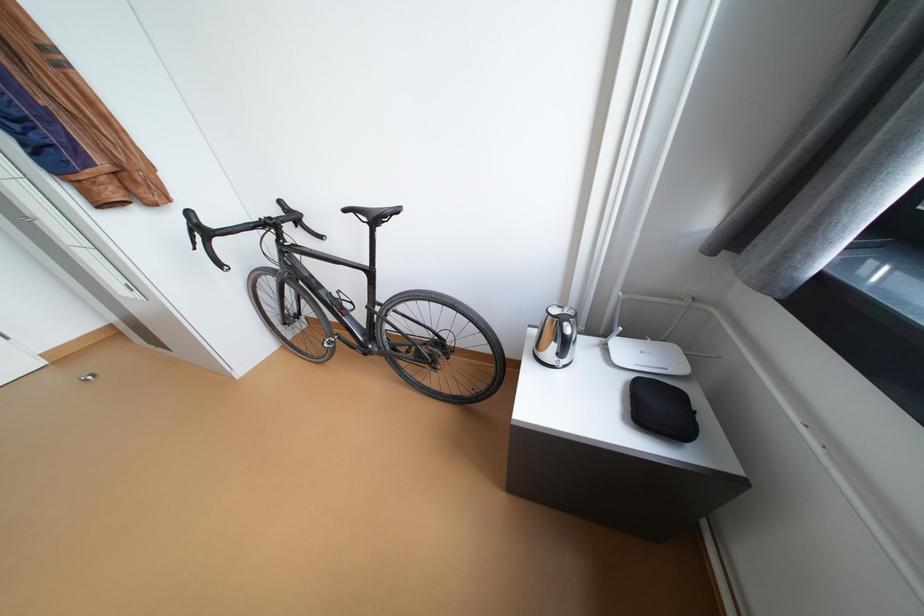
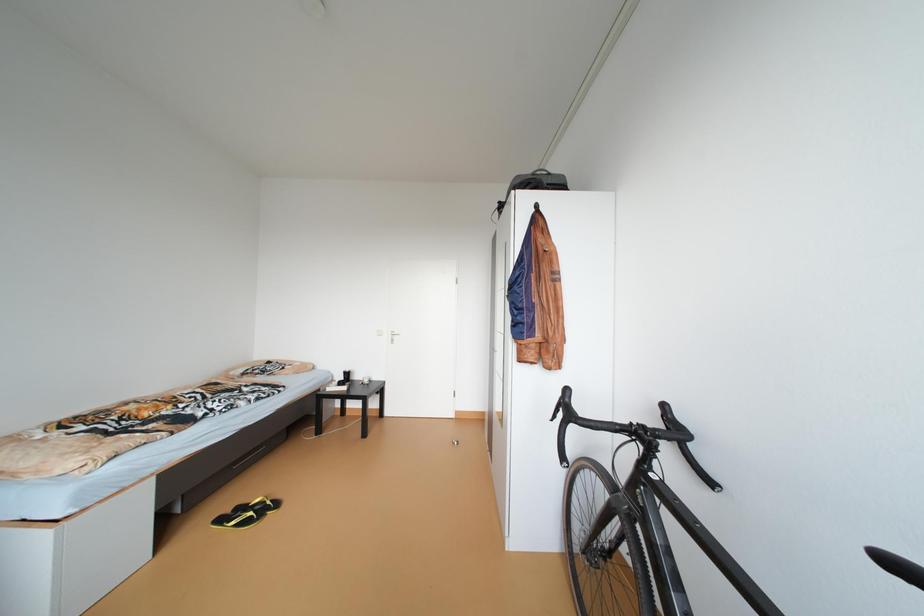
Question: How did the camera likely rotate?

Choices:
 (A) Left
 (B) Right
 (C) Up
 (D) Down

Answer: (A)